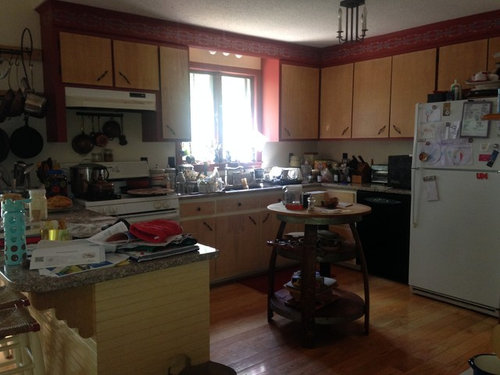
Locate an element on the screen. Image resolution: width=500 pixels, height=375 pixels. cabinet is located at coordinates (363, 103).